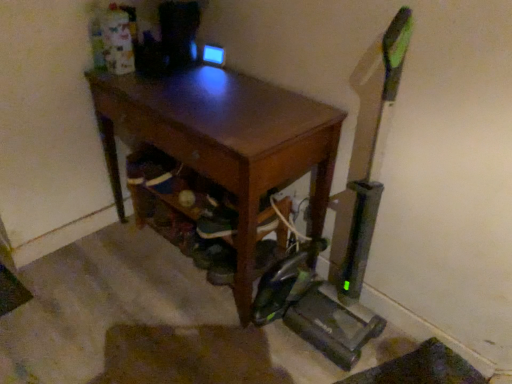
Question: Is brown wooden desk at center positioned with its back to green fabric shoe at lower center?

Choices:
 (A) no
 (B) yes

Answer: (B)

Question: Does brown wooden desk at center have a larger size compared to green fabric shoe at lower center?

Choices:
 (A) no
 (B) yes

Answer: (B)

Question: From the image's perspective, is brown wooden desk at center on top of green fabric shoe at lower center?

Choices:
 (A) yes
 (B) no

Answer: (A)

Question: Is green fabric shoe at lower center completely or partially inside brown wooden desk at center?

Choices:
 (A) no
 (B) yes

Answer: (B)

Question: Is brown wooden desk at center smaller than green fabric shoe at lower center?

Choices:
 (A) no
 (B) yes

Answer: (A)

Question: Is brown wooden desk at center behind green fabric shoe at lower center?

Choices:
 (A) yes
 (B) no

Answer: (B)

Question: Considering the relative positions of green fabric shoe at lower center and brown wooden desk at center in the image provided, is green fabric shoe at lower center behind brown wooden desk at center?

Choices:
 (A) yes
 (B) no

Answer: (A)

Question: Can you confirm if green fabric shoe at lower center is positioned to the right of brown wooden desk at center?

Choices:
 (A) no
 (B) yes

Answer: (B)

Question: From a real-world perspective, is green fabric shoe at lower center located higher than brown wooden desk at center?

Choices:
 (A) yes
 (B) no

Answer: (B)

Question: Is green fabric shoe at lower center outside of brown wooden desk at center?

Choices:
 (A) yes
 (B) no

Answer: (B)

Question: Considering the relative positions of green fabric shoe at lower center and brown wooden desk at center in the image provided, is green fabric shoe at lower center in front of brown wooden desk at center?

Choices:
 (A) no
 (B) yes

Answer: (A)

Question: From the image's perspective, is green fabric shoe at lower center over brown wooden desk at center?

Choices:
 (A) no
 (B) yes

Answer: (A)

Question: Is point (254, 259) positioned closer to the camera than point (162, 147)?

Choices:
 (A) farther
 (B) closer

Answer: (A)